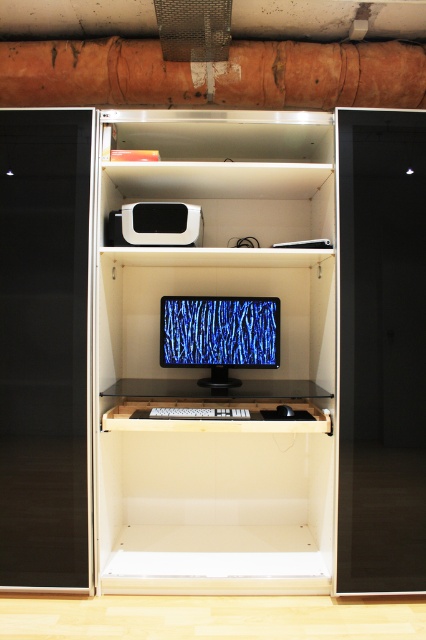
Question: From the image, what is the correct spatial relationship of black glossy monitor at center in relation to matte black monitor at center?

Choices:
 (A) below
 (B) above

Answer: (A)

Question: Which point is closer to the camera?

Choices:
 (A) (221, 310)
 (B) (101, 499)

Answer: (B)

Question: Does black glossy monitor at center appear on the right side of matte black monitor at center?

Choices:
 (A) no
 (B) yes

Answer: (A)

Question: Which point is closer to the camera?

Choices:
 (A) black glossy monitor at center
 (B) matte black monitor at center

Answer: (A)

Question: Considering the relative positions of black glossy monitor at center and matte black monitor at center in the image provided, where is black glossy monitor at center located with respect to matte black monitor at center?

Choices:
 (A) above
 (B) below

Answer: (B)